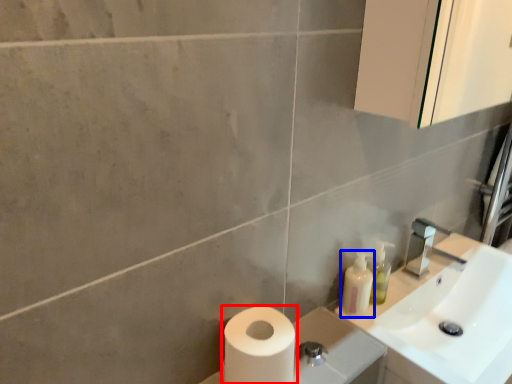
Question: Which of the following is the closest to the observer, toilet paper (highlighted by a red box) or toiletry (highlighted by a blue box)?

Choices:
 (A) toilet paper
 (B) toiletry

Answer: (A)